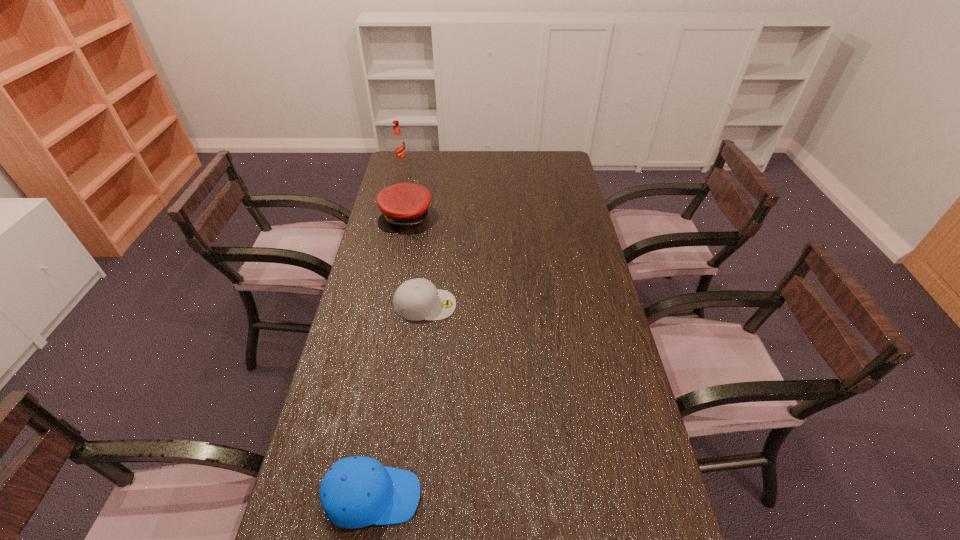
The image size is (960, 540). Identify the location of object that is at the far edge. (398, 143).

What are the coordinates of `root beer that is at the left edge` in the screenshot? It's located at (398, 143).

I want to click on object that is positioned at the far left corner, so 398,143.

The width and height of the screenshot is (960, 540). In the image, there is a desktop. Find the location of `free space at the far edge`. free space at the far edge is located at coordinates (444, 151).

The image size is (960, 540). In the image, there is a desktop. In order to click on free space at the left edge in this screenshot , I will do `click(403, 238)`.

The width and height of the screenshot is (960, 540). I want to click on free space at the right edge, so click(597, 427).

The width and height of the screenshot is (960, 540). I want to click on free space at the far right corner of the desktop, so click(546, 152).

Identify the location of vacant space that's between the root beer and the nearest cap. (387, 330).

The height and width of the screenshot is (540, 960). In order to click on vacant space in between the farthest cap and the second nearest object in this screenshot , I will do `click(416, 261)`.

Locate an element on the screen. free space between the third nearest object and the third farthest object is located at coordinates (416, 261).